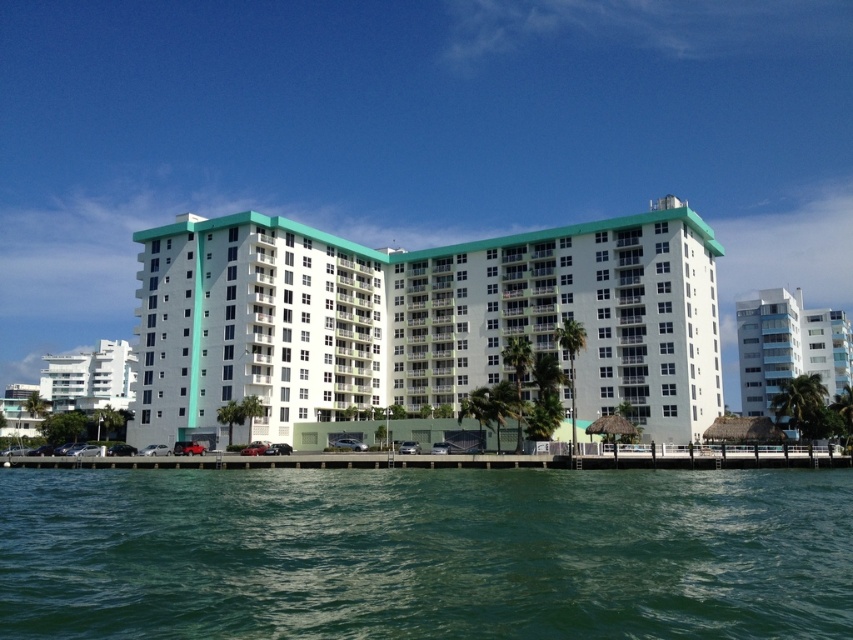
You are a tourist planning to take a photo of both the white glass building at right and the white glossy building at left. Which building should you stand closer to in order to capture both in a single frame without zooming?

You should stand closer to the white glossy building at left because the white glass building at right is taller, so positioning yourself closer to the shorter building allows both structures to fit within the camera frame more easily.

You are standing on the paved area in front of the white glass building at right and want to look at the green water at lower center. Which object is closer to your eyes?

The green water at lower center is closer to your eyes than the white glass building at right because it has a lesser height.